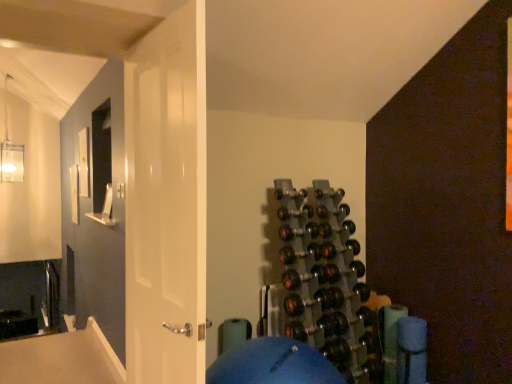
Question: Is metallic gray wine rack at center-right located outside white glossy door at center?

Choices:
 (A) yes
 (B) no

Answer: (A)

Question: From a real-world perspective, is metallic gray wine rack at center-right beneath white glossy door at center?

Choices:
 (A) no
 (B) yes

Answer: (B)

Question: Is metallic gray wine rack at center-right thinner than white glossy door at center?

Choices:
 (A) no
 (B) yes

Answer: (A)

Question: From a real-world perspective, is metallic gray wine rack at center-right on top of white glossy door at center?

Choices:
 (A) yes
 (B) no

Answer: (B)

Question: Does metallic gray wine rack at center-right appear on the right side of white glossy door at center?

Choices:
 (A) no
 (B) yes

Answer: (B)

Question: Is metallic gray wine rack at center-right facing away from white glossy door at center?

Choices:
 (A) yes
 (B) no

Answer: (B)

Question: Is metallic gray wine rack at center-right completely or partially inside white glossy door at center?

Choices:
 (A) no
 (B) yes

Answer: (A)

Question: Considering the relative sizes of white glossy door at center and metallic gray wine rack at center-right in the image provided, is white glossy door at center shorter than metallic gray wine rack at center-right?

Choices:
 (A) yes
 (B) no

Answer: (B)

Question: Considering the relative positions of white glossy door at center and metallic gray wine rack at center-right in the image provided, is white glossy door at center in front of metallic gray wine rack at center-right?

Choices:
 (A) no
 (B) yes

Answer: (B)

Question: Is white glossy door at center to the left of metallic gray wine rack at center-right from the viewer's perspective?

Choices:
 (A) no
 (B) yes

Answer: (B)

Question: From the image's perspective, is white glossy door at center over metallic gray wine rack at center-right?

Choices:
 (A) no
 (B) yes

Answer: (B)

Question: Is white glossy door at center oriented towards metallic gray wine rack at center-right?

Choices:
 (A) no
 (B) yes

Answer: (A)

Question: Would you say metallic gray wine rack at center-right is to the left or to the right of white glossy door at center in the picture?

Choices:
 (A) right
 (B) left

Answer: (A)